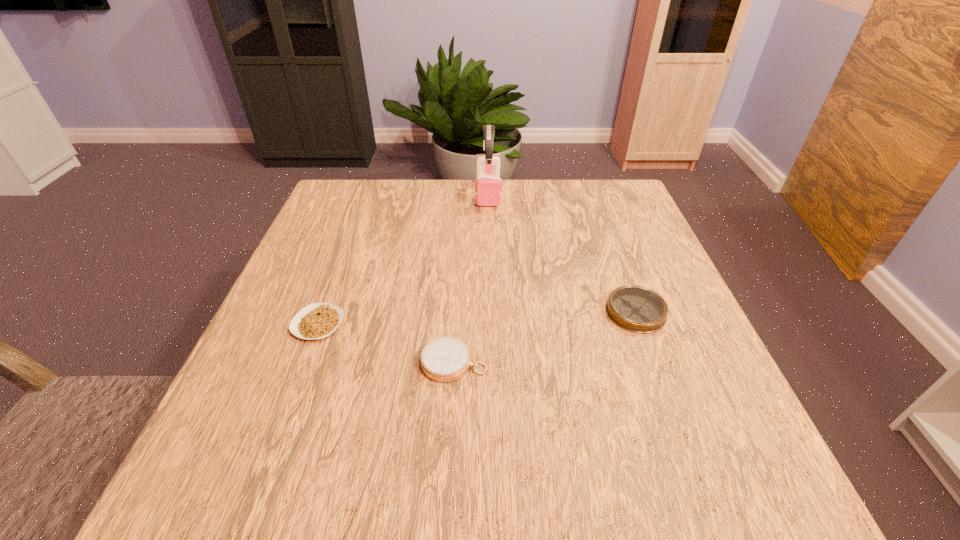
Find the location of a particular element. This screenshot has height=540, width=960. the tallest object is located at coordinates (488, 187).

Image resolution: width=960 pixels, height=540 pixels. Identify the location of the farthest object. (488, 187).

Image resolution: width=960 pixels, height=540 pixels. Find the location of `the right compass`. the right compass is located at coordinates (637, 309).

Locate an element on the screen. This screenshot has height=540, width=960. the rightmost object is located at coordinates (637, 309).

You are a GUI agent. You are given a task and a screenshot of the screen. Output one action in this format:
    pyautogui.click(x=<x>, y=<y>)
    Task: Click on the nearer compass
    
    Given the screenshot: What is the action you would take?
    pyautogui.click(x=444, y=359)

What are the coordinates of `the leftmost object` in the screenshot? It's located at (318, 320).

Locate an element on the screen. Image resolution: width=960 pixels, height=540 pixels. vacant space located 0.350m on the outer surface of the tallest object is located at coordinates (491, 300).

Where is `vacant space situated 0.390m on the left of the farther compass`? vacant space situated 0.390m on the left of the farther compass is located at coordinates (409, 312).

The width and height of the screenshot is (960, 540). Identify the location of free space located 0.140m on the left of the nearer compass. (342, 362).

Find the location of a particular element. free region located on the front of the legume is located at coordinates (257, 487).